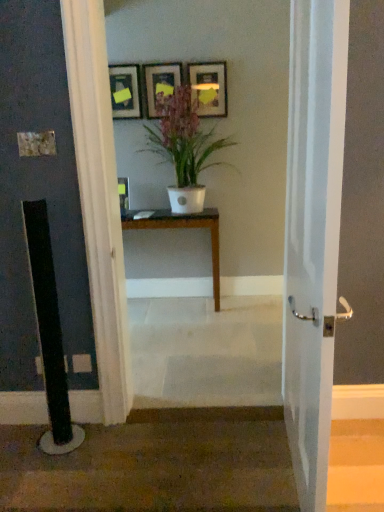
Question: Does white glossy door at center have a larger size compared to matte wooden picture frame at upper center, acting as the second picture frame starting from the right?

Choices:
 (A) yes
 (B) no

Answer: (A)

Question: Can you confirm if white glossy door at center is shorter than matte wooden picture frame at upper center, the second picture frame positioned from the left?

Choices:
 (A) yes
 (B) no

Answer: (B)

Question: Is white glossy door at center to the left of matte wooden picture frame at upper center, acting as the second picture frame starting from the right, from the viewer's perspective?

Choices:
 (A) yes
 (B) no

Answer: (B)

Question: Is white glossy door at center smaller than matte wooden picture frame at upper center, acting as the second picture frame starting from the right?

Choices:
 (A) no
 (B) yes

Answer: (A)

Question: Is matte wooden picture frame at upper center, the second picture frame positioned from the left, surrounded by white glossy door at center?

Choices:
 (A) no
 (B) yes

Answer: (A)

Question: In terms of width, does matte wooden picture frame at upper center, acting as the second picture frame starting from the right, look wider or thinner when compared to wooden table at center?

Choices:
 (A) thin
 (B) wide

Answer: (A)

Question: Is matte wooden picture frame at upper center, acting as the second picture frame starting from the right, bigger or smaller than wooden table at center?

Choices:
 (A) small
 (B) big

Answer: (A)

Question: From the image's perspective, relative to wooden table at center, is matte wooden picture frame at upper center, the second picture frame positioned from the left, above or below?

Choices:
 (A) below
 (B) above

Answer: (B)

Question: Visually, is matte wooden picture frame at upper center, the second picture frame positioned from the left, positioned to the left or to the right of wooden table at center?

Choices:
 (A) left
 (B) right

Answer: (A)

Question: Which is correct: matte gold picture frame at upper center, marked as the third picture frame in a left-to-right arrangement, is inside wooden table at center, or outside of it?

Choices:
 (A) inside
 (B) outside

Answer: (B)

Question: From a real-world perspective, is matte gold picture frame at upper center, marked as the third picture frame in a left-to-right arrangement, physically located above or below wooden table at center?

Choices:
 (A) above
 (B) below

Answer: (A)

Question: Is matte gold picture frame at upper center, acting as the first picture frame starting from the right, wider or thinner than wooden table at center?

Choices:
 (A) wide
 (B) thin

Answer: (B)

Question: From the image's perspective, is matte gold picture frame at upper center, marked as the third picture frame in a left-to-right arrangement, positioned above or below wooden table at center?

Choices:
 (A) below
 (B) above

Answer: (B)

Question: From the image's perspective, is brown carpet at lower left above or below matte black picture frame at upper center, the first picture frame positioned from the left?

Choices:
 (A) below
 (B) above

Answer: (A)

Question: Is brown carpet at lower left inside the boundaries of matte black picture frame at upper center, positioned as the 3th picture frame in right-to-left order, or outside?

Choices:
 (A) inside
 (B) outside

Answer: (B)